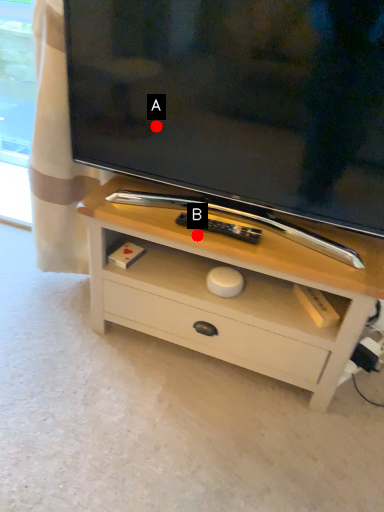
Question: Two points are circled on the image, labeled by A and B beside each circle. Among these points, which one is farthest from the camera?

Choices:
 (A) A is further
 (B) B is further

Answer: (A)